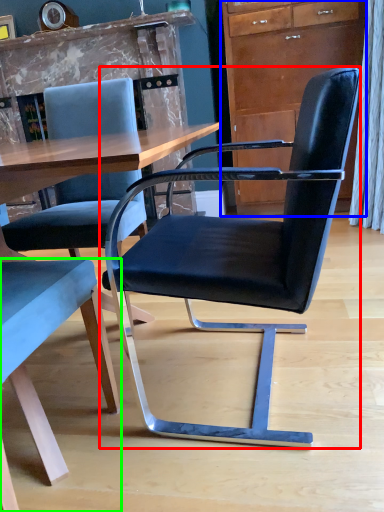
Question: Which object is positioned farthest from chair (highlighted by a red box)? Select from cabinetry (highlighted by a blue box) and chair (highlighted by a green box).

Choices:
 (A) cabinetry
 (B) chair

Answer: (A)